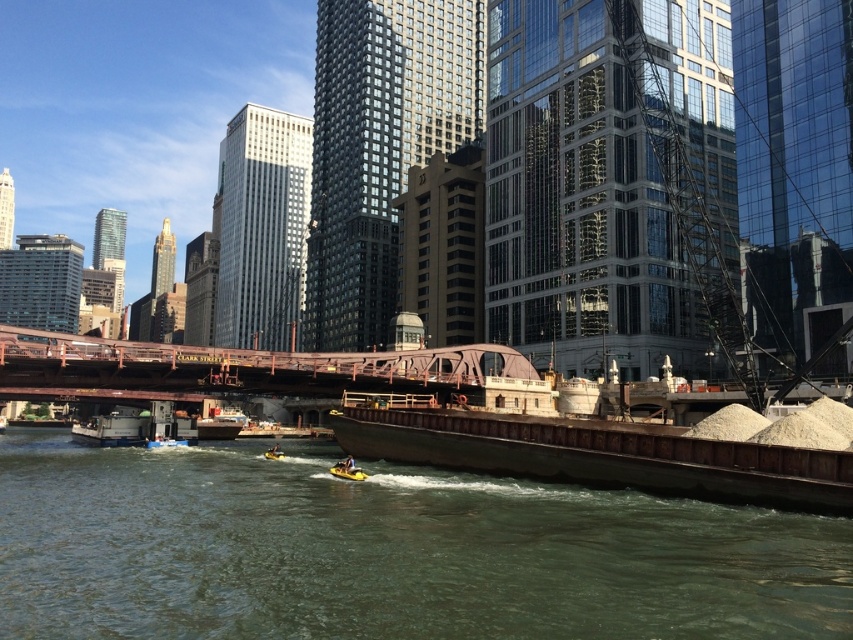
Question: Can you confirm if greenish water at lower center is smaller than brown metallic barge at lower center?

Choices:
 (A) no
 (B) yes

Answer: (A)

Question: Is metallic gray barge at lower left positioned behind yellow rubber boat at center?

Choices:
 (A) yes
 (B) no

Answer: (A)

Question: Which point appears farthest from the camera in this image?

Choices:
 (A) (129, 440)
 (B) (346, 474)
 (C) (448, 467)
 (D) (97, 390)

Answer: (D)

Question: Among these points, which one is farthest from the camera?

Choices:
 (A) (490, 353)
 (B) (570, 572)
 (C) (740, 472)
 (D) (126, 419)

Answer: (D)

Question: Is rustic metal bridge at center to the right of yellow rubber boat at center from the viewer's perspective?

Choices:
 (A) no
 (B) yes

Answer: (A)

Question: Which of these objects is positioned farthest from the brown metallic barge at lower center?

Choices:
 (A) rustic metal bridge at center
 (B) greenish water at lower center
 (C) metallic gray barge at lower left

Answer: (C)